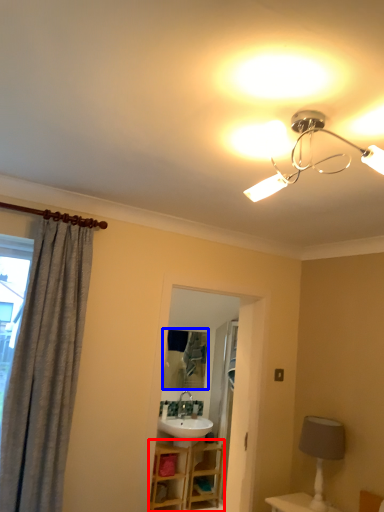
Question: Which object is closer to the camera taking this photo, vanity (highlighted by a red box) or mirror (highlighted by a blue box)?

Choices:
 (A) vanity
 (B) mirror

Answer: (A)